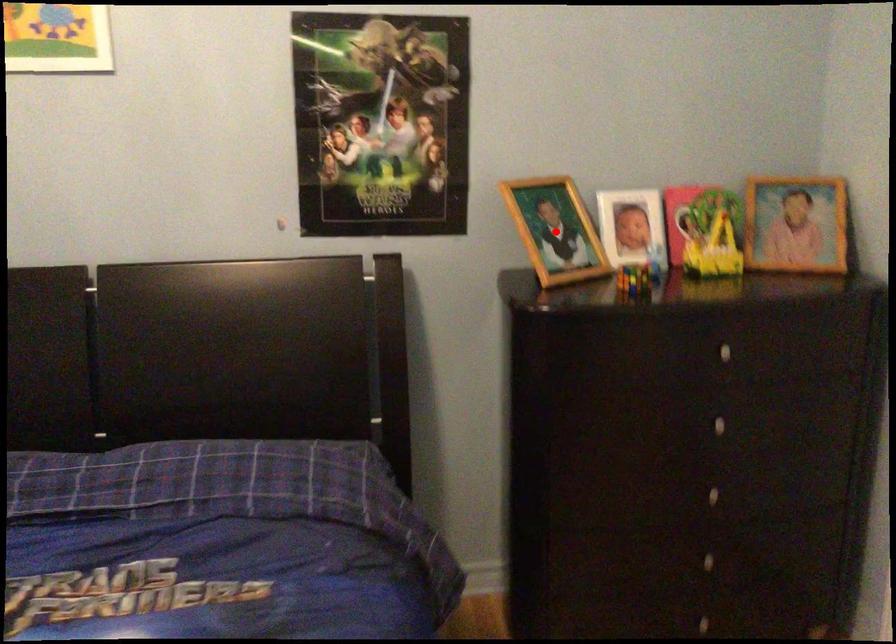
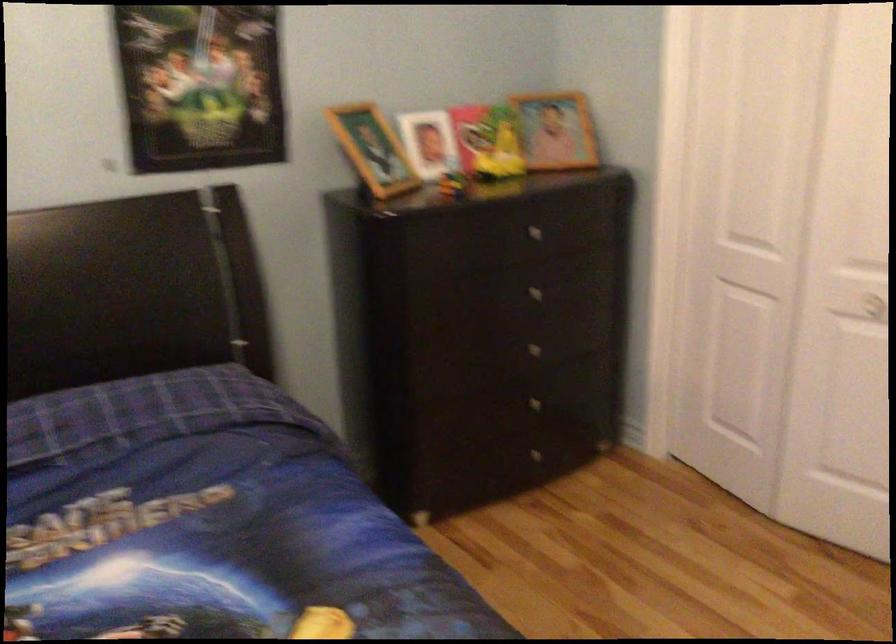
Question: I am providing you with two images of the same scene from different viewpoints. Image1 has a red point marked. In image2, the corresponding 3D location appears at what relative position? Reply with the corresponding letter.

Choices:
 (A) Closer
 (B) Farther

Answer: (B)